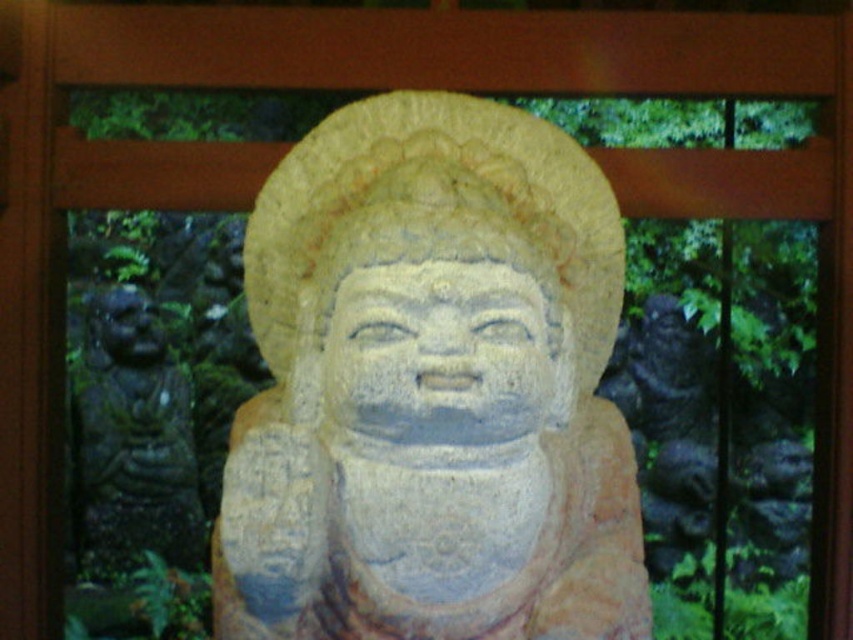
Question: Does yellow stone statue at center appear on the right side of dark gray stone statue at left?

Choices:
 (A) yes
 (B) no

Answer: (A)

Question: Which object is positioned closest to the yellow stone statue at center?

Choices:
 (A) smooth stone statue at center
 (B) dark gray stone statue at left

Answer: (A)

Question: Does yellow stone statue at center appear over dark gray stone statue at left?

Choices:
 (A) yes
 (B) no

Answer: (A)

Question: Which object is closer to the camera taking this photo?

Choices:
 (A) dark gray stone statue at left
 (B) smooth stone statue at center
 (C) yellow stone statue at center

Answer: (B)

Question: Estimate the real-world distances between objects in this image. Which object is closer to the yellow stone statue at center?

Choices:
 (A) smooth stone statue at center
 (B) dark gray stone statue at left

Answer: (A)

Question: Is smooth stone statue at center behind dark gray stone statue at left?

Choices:
 (A) no
 (B) yes

Answer: (A)